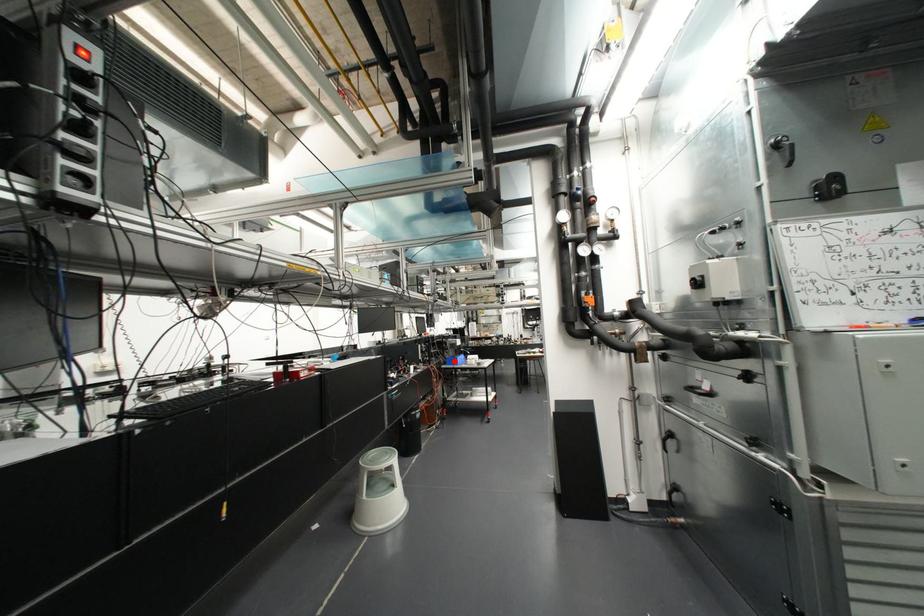
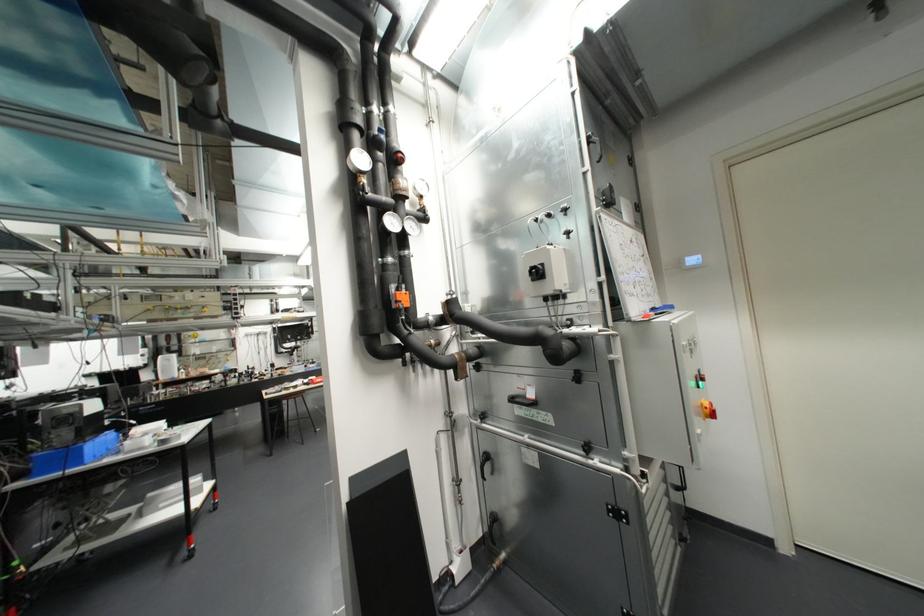
In the second image, find the point that corresponds to the highlighted location in the first image.

(71, 459)